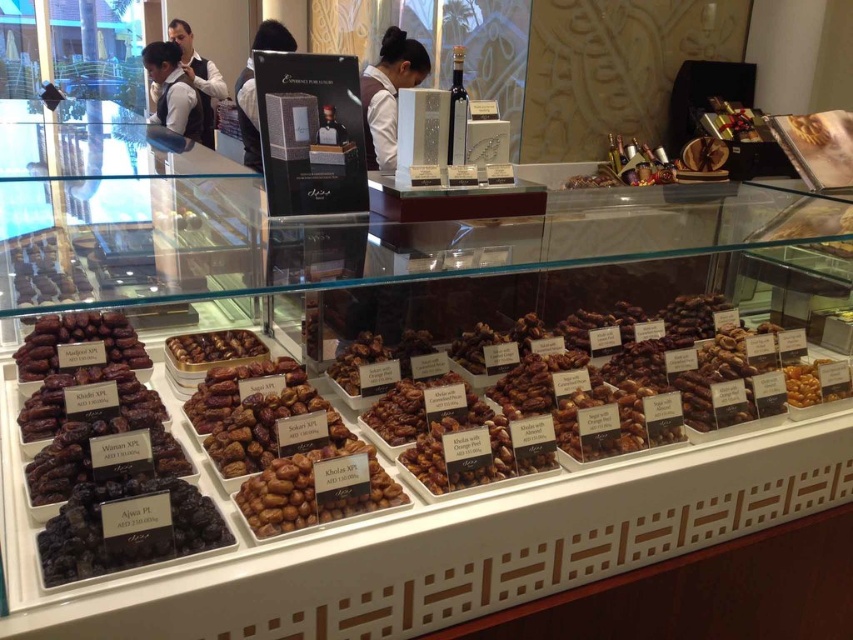
Question: Which of the following is the closest to the observer?

Choices:
 (A) (192, 486)
 (B) (215, 340)

Answer: (A)

Question: Can you confirm if white uniform at center is thinner than white shirt at upper left?

Choices:
 (A) no
 (B) yes

Answer: (B)

Question: Does black matte ajwa dates at lower left have a greater width compared to white shirt at upper left?

Choices:
 (A) no
 (B) yes

Answer: (A)

Question: Which of these objects is positioned closest to the dark brown dried fruit at lower left?

Choices:
 (A) brown matte nuts at center
 (B) brown matte dates at center
 (C) white shirt at upper left
 (D) white uniform at center

Answer: (B)

Question: Which of the following is the closest to the observer?

Choices:
 (A) (370, 88)
 (B) (267, 470)

Answer: (B)

Question: Observing the image, what is the correct spatial positioning of dark brown dried fruit at lower left in reference to white uniform at center?

Choices:
 (A) below
 (B) above

Answer: (A)